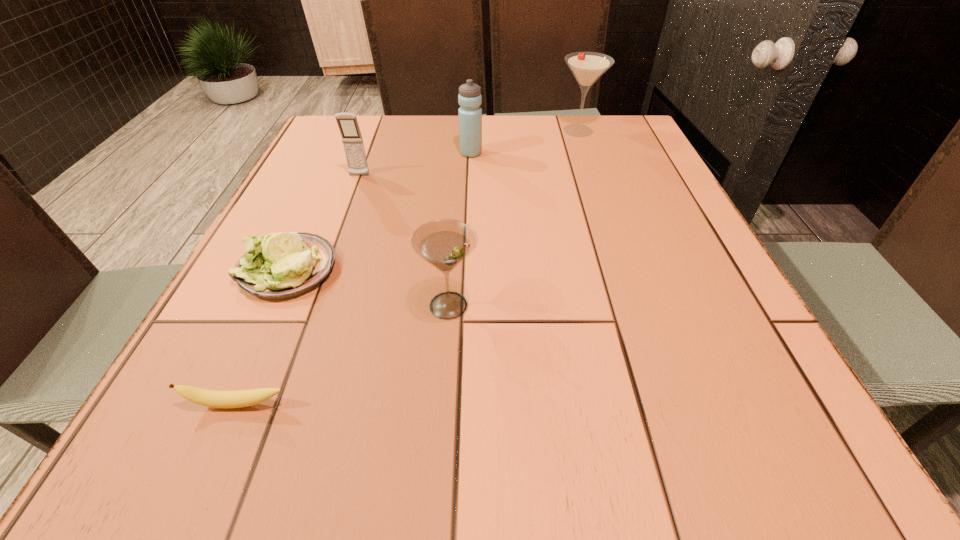
This screenshot has height=540, width=960. Find the location of `object present at the far right corner`. object present at the far right corner is located at coordinates (587, 67).

Identify the location of free spot at the far edge of the desktop. (382, 120).

The width and height of the screenshot is (960, 540). Find the location of `free space at the near edge of the desktop`. free space at the near edge of the desktop is located at coordinates (544, 458).

The height and width of the screenshot is (540, 960). What are the coordinates of `vacant space at the left edge of the desktop` in the screenshot? It's located at (253, 310).

Find the location of `vacant space at the right edge of the desktop`. vacant space at the right edge of the desktop is located at coordinates (595, 164).

Identify the location of free space at the far left corner of the desktop. Image resolution: width=960 pixels, height=540 pixels. click(x=361, y=120).

Find the location of `vacant space at the far right corner`. vacant space at the far right corner is located at coordinates (626, 144).

Image resolution: width=960 pixels, height=540 pixels. I want to click on vacant region between the cellular telephone and the left martini, so click(x=404, y=241).

The width and height of the screenshot is (960, 540). I want to click on vacant space that is in between the rightmost object and the second shortest object, so click(433, 200).

You are a GUI agent. You are given a task and a screenshot of the screen. Output one action in this format:
    pyautogui.click(x=<x>, y=<y>)
    Task: Click on the vacant area that lies between the shortest object and the left martini
    The height and width of the screenshot is (540, 960).
    Given the screenshot: What is the action you would take?
    pyautogui.click(x=343, y=355)